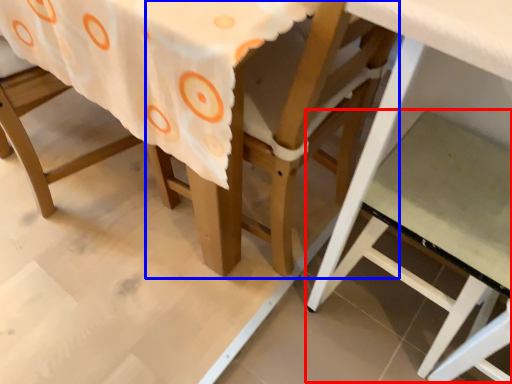
Question: Which object appears closest to the camera in this image, step stool (highlighted by a red box) or chair (highlighted by a blue box)?

Choices:
 (A) step stool
 (B) chair

Answer: (B)